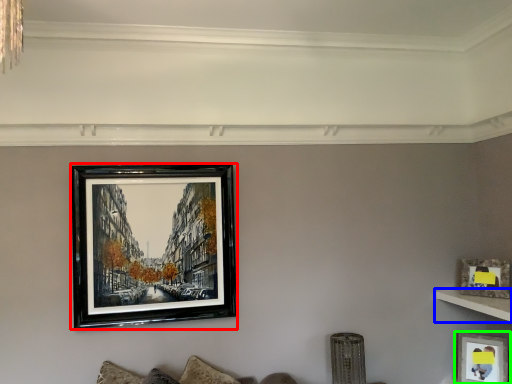
Question: Which is nearer to the picture frame (highlighted by a red box)? shelf (highlighted by a blue box) or picture frame (highlighted by a green box).

Choices:
 (A) shelf
 (B) picture frame

Answer: (A)